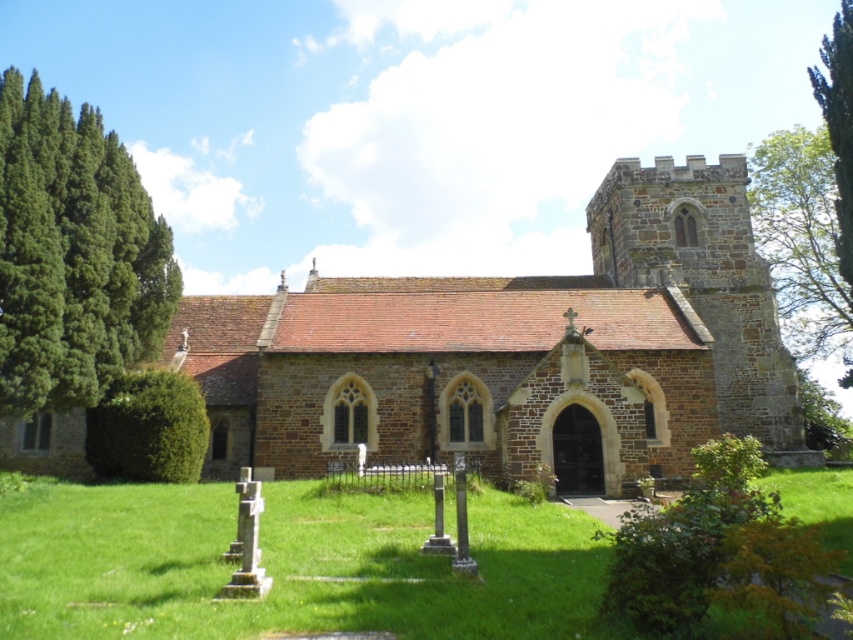
From the picture: You are planning to take a photo of the brown stone church at center and the green coniferous tree at left. If you want to ensure both are fully visible in the frame, which object should you position closer to the camera?

The brown stone church at center might be wider than the green coniferous tree at left, so you should position the brown stone church at center closer to the camera to ensure both fit in the frame.

You are standing in the churchyard and want to determine which tree is taller between the green coniferous tree at left and the green leafy tree at upper right. Based on the scene, which one is taller?

The green leafy tree at upper right is taller than the green coniferous tree at left.